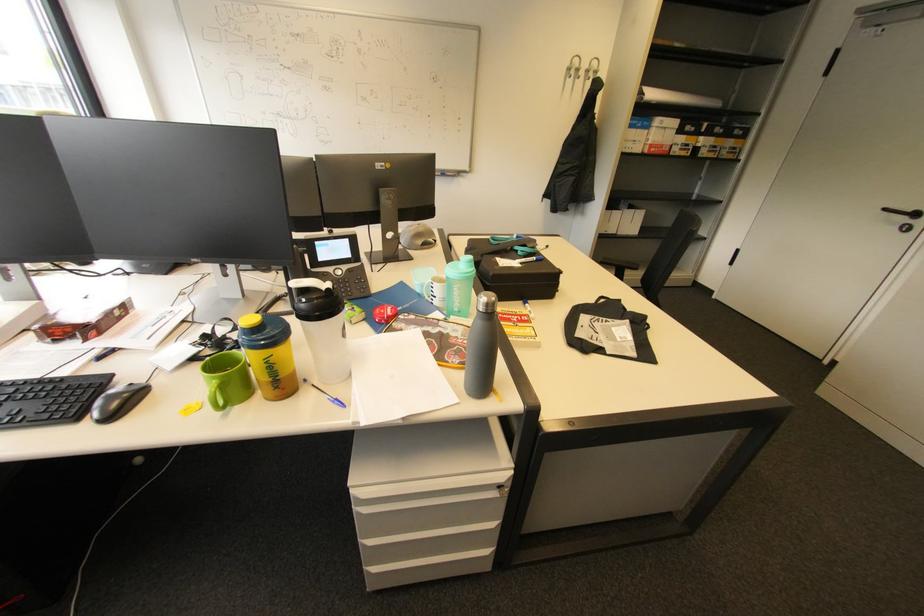
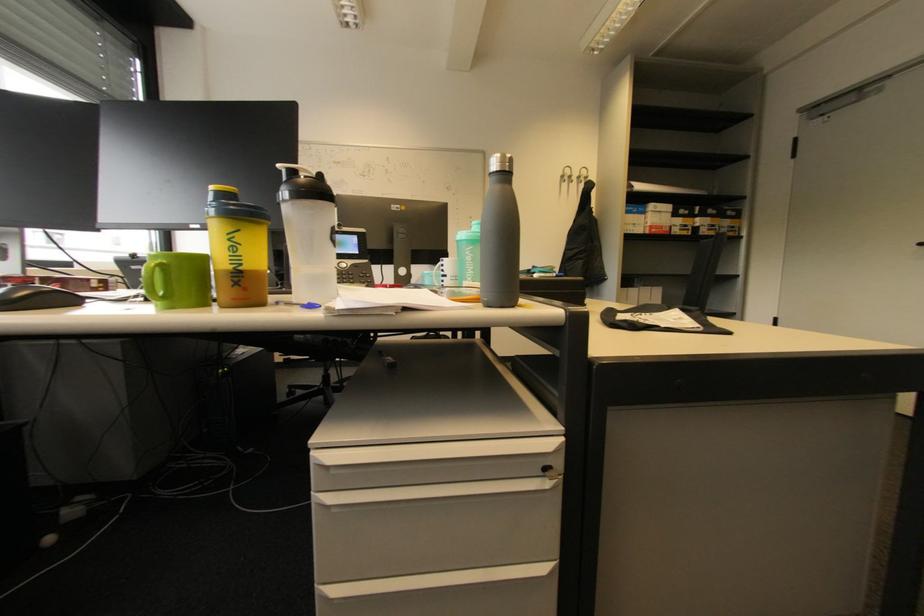
The point at (574, 70) is marked in the first image. Where is the corresponding point in the second image?

(567, 177)